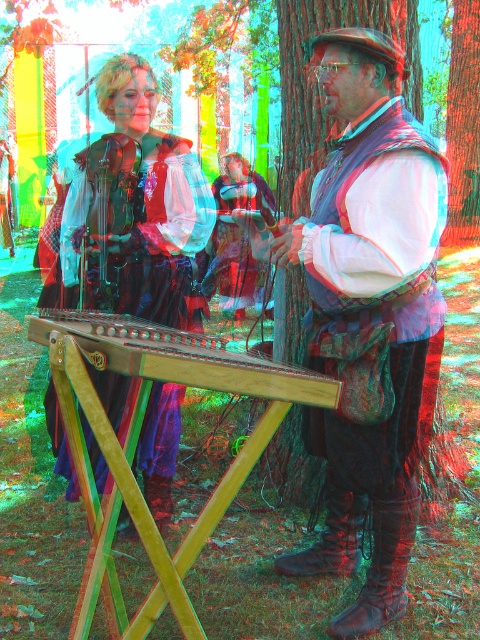
What do you see at coordinates (371, 314) in the screenshot? I see `matte brown vest at center` at bounding box center [371, 314].

Which is behind, point (345, 230) or point (475, 134)?

The point (475, 134) is behind.

Does point (393, 314) lie in front of point (464, 106)?

Yes, it is in front of point (464, 106).

The image size is (480, 640). I want to click on matte brown vest at center, so click(371, 314).

In the scene shown: Is matte brown vest at center shorter than matte black dress at center?

Incorrect, matte brown vest at center's height does not fall short of matte black dress at center's.

Can you confirm if matte brown vest at center is wider than matte black dress at center?

No, matte brown vest at center is not wider than matte black dress at center.

Identify the location of matte brown vest at center. (371, 314).

This screenshot has width=480, height=640. I want to click on matte black dress at center, so click(133, 209).

What do you see at coordinates (133, 209) in the screenshot? I see `matte black dress at center` at bounding box center [133, 209].

At what (x,y) coordinates should I click in order to perform the action: click on matte black dress at center. Please return your answer as a coordinate pair (x, y). The height and width of the screenshot is (640, 480). Looking at the image, I should click on (133, 209).